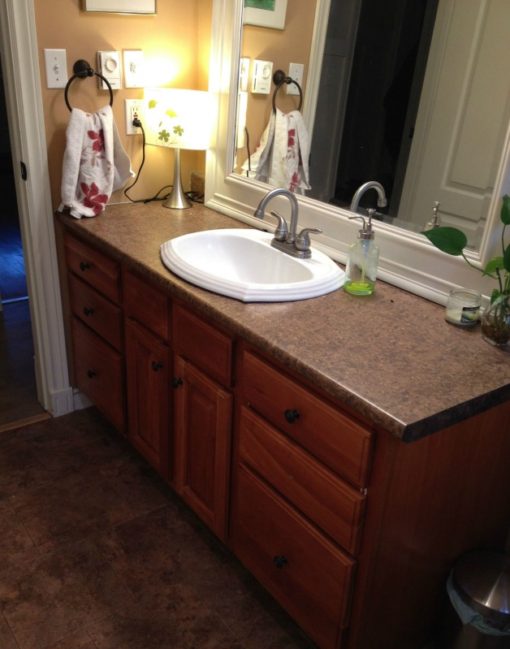
Identify the location of soap. This screenshot has height=649, width=510. (353, 286).